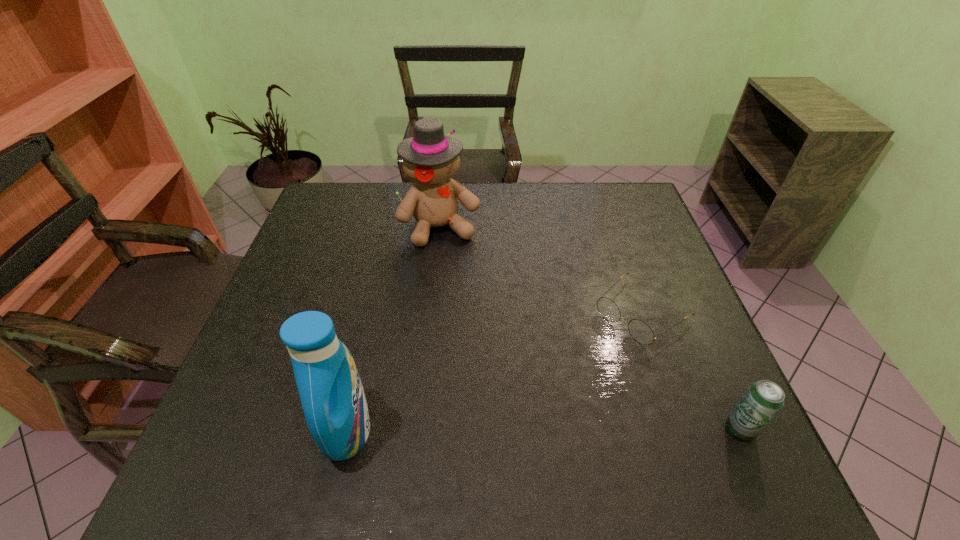
You are a GUI agent. You are given a task and a screenshot of the screen. Output one action in this format:
    pyautogui.click(x=<x>, y=<y>)
    Task: Click on the vacant point located 0.060m on the front-facing side of the farthest object
    
    Given the screenshot: What is the action you would take?
    pyautogui.click(x=457, y=262)

Identify the location of free spot located 0.260m on the front-facing side of the farthest object. The width and height of the screenshot is (960, 540). (480, 314).

Identify the location of vacant space located 0.350m on the front-facing side of the farthest object. (492, 342).

Locate an element on the screen. This screenshot has width=960, height=540. object that is at the far edge is located at coordinates (430, 158).

This screenshot has height=540, width=960. I want to click on detergent situated at the near edge, so click(331, 392).

You are a GUI agent. You are given a task and a screenshot of the screen. Output one action in this format:
    pyautogui.click(x=<x>, y=<y>)
    Task: Click on the beer can present at the near edge
    Image resolution: width=960 pixels, height=540 pixels.
    Given the screenshot: What is the action you would take?
    pyautogui.click(x=763, y=400)

Locate an element on the screen. The image size is (960, 540). beer can that is at the right edge is located at coordinates (763, 400).

Find the location of a particular element. spectacles that is at the right edge is located at coordinates (640, 331).

You are a GUI agent. You are given a task and a screenshot of the screen. Output one action in this format:
    pyautogui.click(x=<x>, y=<y>)
    Task: Click on the object that is at the near right corner
    The height and width of the screenshot is (540, 960).
    Given the screenshot: What is the action you would take?
    pyautogui.click(x=763, y=400)

Find the location of a particular element. The height and width of the screenshot is (540, 960). vacant area at the far edge is located at coordinates (464, 218).